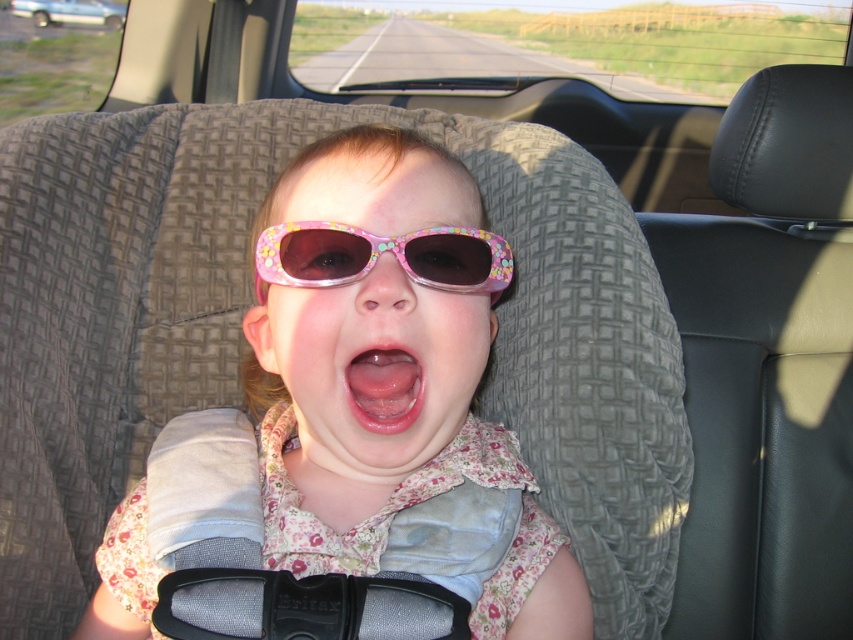
Is point (422, 236) behind point (392, 401)?

Yes, it is.

Measure the distance between point (463, 284) and camera.

Point (463, 284) is 27.28 inches from camera.

Is point (508, 264) behind point (378, 396)?

Yes, it is.

Locate an element on the screen. The height and width of the screenshot is (640, 853). pink floral plastic goggles at center is located at coordinates (379, 253).

Between pink glossy lips at center and metallic silver car at upper left, which one has less height?

pink glossy lips at center

Who is more forward, (x=392, y=426) or (x=24, y=10)?

Point (x=392, y=426) is more forward.

You are a GUI agent. You are given a task and a screenshot of the screen. Output one action in this format:
    pyautogui.click(x=<x>, y=<y>)
    Task: Click on the pink glossy lips at center
    
    Given the screenshot: What is the action you would take?
    pyautogui.click(x=384, y=387)

Who is lower down, pink floral fabric at center or pink glossy lips at center?

pink floral fabric at center is below.

Is pink floral fabric at center above pink glossy lips at center?

Incorrect, pink floral fabric at center is not positioned above pink glossy lips at center.

Which is behind, point (352, 534) or point (393, 358)?

The point (352, 534) is behind.

Find the location of a particular element. pink floral fabric at center is located at coordinates (352, 416).